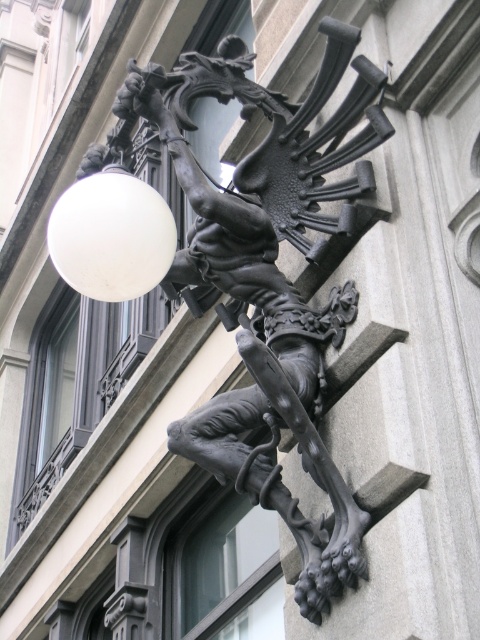
Question: Is black matte sculpture at upper center wider than white matte sphere at upper left?

Choices:
 (A) no
 (B) yes

Answer: (B)

Question: Which of the following is the closest to the observer?

Choices:
 (A) (103, 220)
 (B) (299, 163)

Answer: (A)

Question: Which point is farther to the camera?

Choices:
 (A) (359, 102)
 (B) (80, 218)

Answer: (A)

Question: Which point is closer to the camera?

Choices:
 (A) black matte sculpture at upper center
 (B) white matte sphere at upper left

Answer: (A)

Question: Is black matte sculpture at upper center below white matte sphere at upper left?

Choices:
 (A) no
 (B) yes

Answer: (A)

Question: Does black matte sculpture at upper center have a greater width compared to white matte sphere at upper left?

Choices:
 (A) yes
 (B) no

Answer: (A)